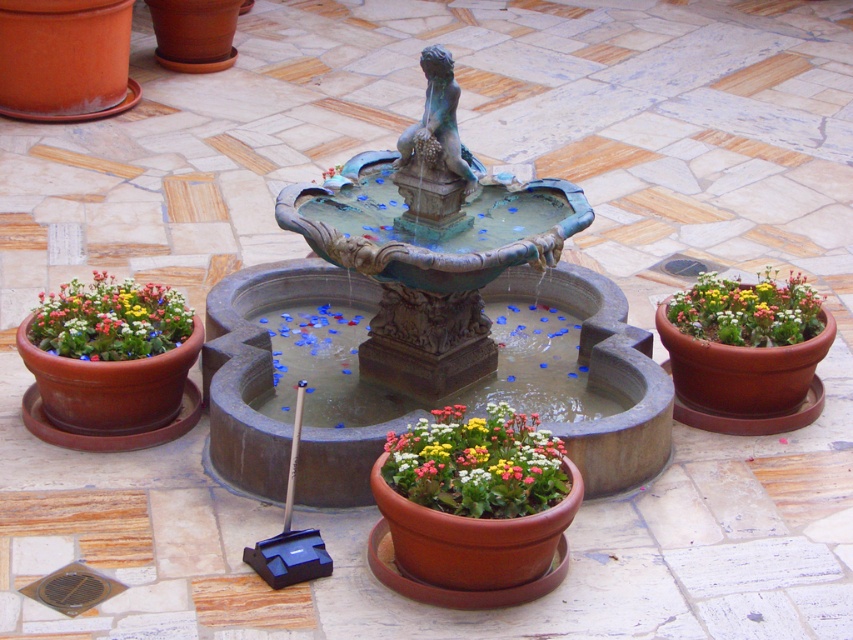
You are a gardener who needs to water the plants. You are standing at the matte terracotta pot at left and want to reach the nearest water source, which is the green patina fountain at center. Can you carry a watering can to the fountain without needing to walk more than 5 feet?

The distance between the matte terracotta pot at left and the green patina fountain at center is 4.96 feet, which is less than 5 feet. Therefore, you can carry the watering can to the fountain without exceeding the 5 feet limit.

You are standing in the garden and want to water the matte terracotta pot at center. If your watering can has a range of 20 feet, will you need to move closer to water it?

The matte terracotta pot at center is 21.15 feet away from the viewer, which is beyond the watering can range of 20 feet. You will need to move closer to water it.

You are standing in the garden and want to place a new decorative item between the green patina fountain at center and the matte terracotta pot at right. Based on their positions, which object should the new item be closer to?

The new decorative item should be placed closer to the matte terracotta pot at right because the green patina fountain at center is closer to the viewer, meaning the matte terracotta pot at right is farther away. Therefore, the midpoint between them would require the item to be nearer to the farther object to maintain balance.